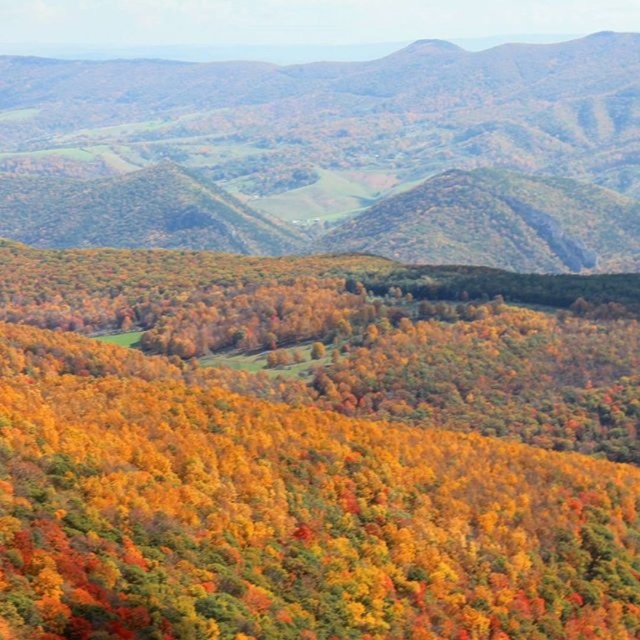
Question: Can you confirm if autumn leaves forest at center is positioned below green leafy forest at center?

Choices:
 (A) yes
 (B) no

Answer: (A)

Question: Which object is farther from the camera taking this photo?

Choices:
 (A) green leafy forest at center
 (B) autumn leaves forest at center

Answer: (A)

Question: Is autumn leaves forest at center to the right of green leafy forest at center from the viewer's perspective?

Choices:
 (A) yes
 (B) no

Answer: (A)

Question: Can you confirm if autumn leaves forest at center is thinner than green leafy forest at center?

Choices:
 (A) yes
 (B) no

Answer: (A)